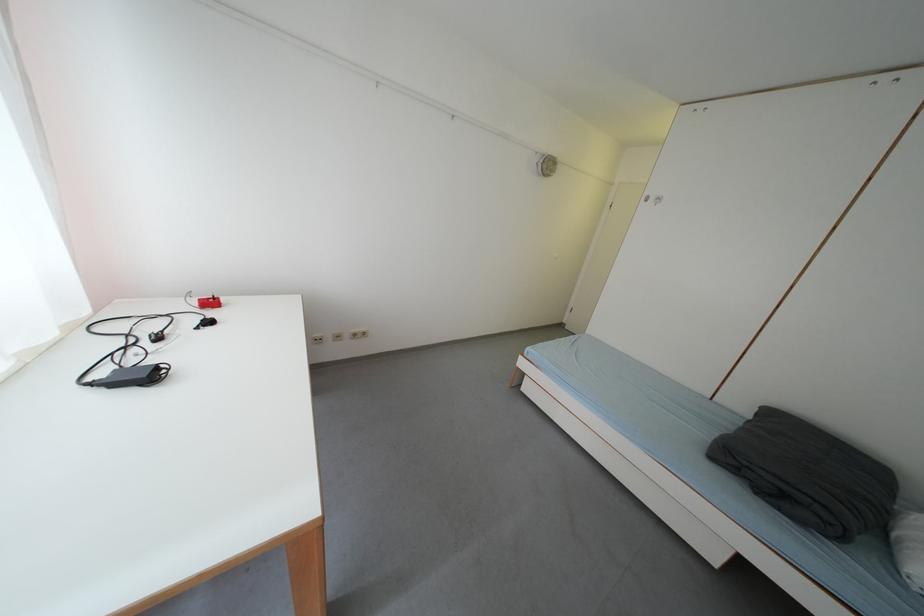
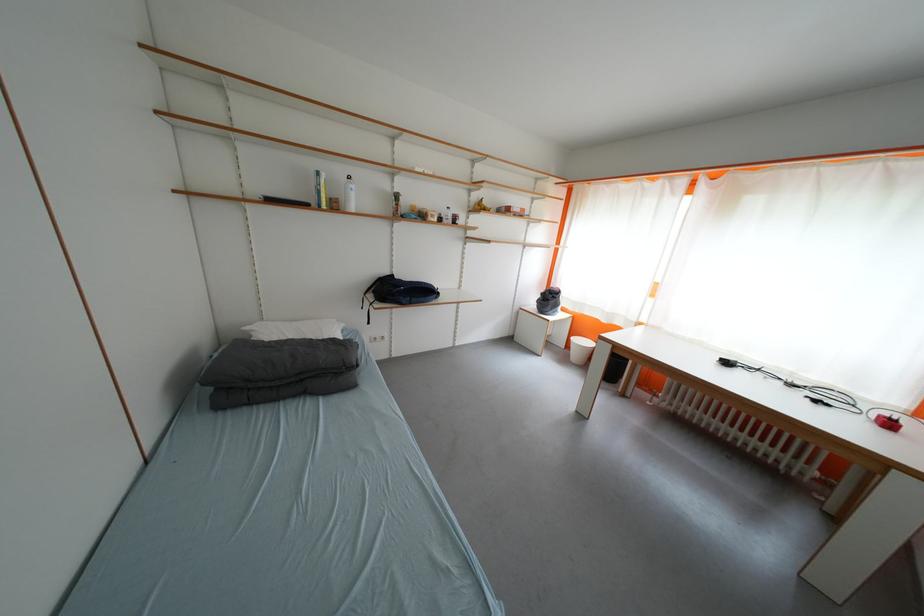
Where in the second image is the point corresponding to the point at 220,306 from the first image?

(897, 428)